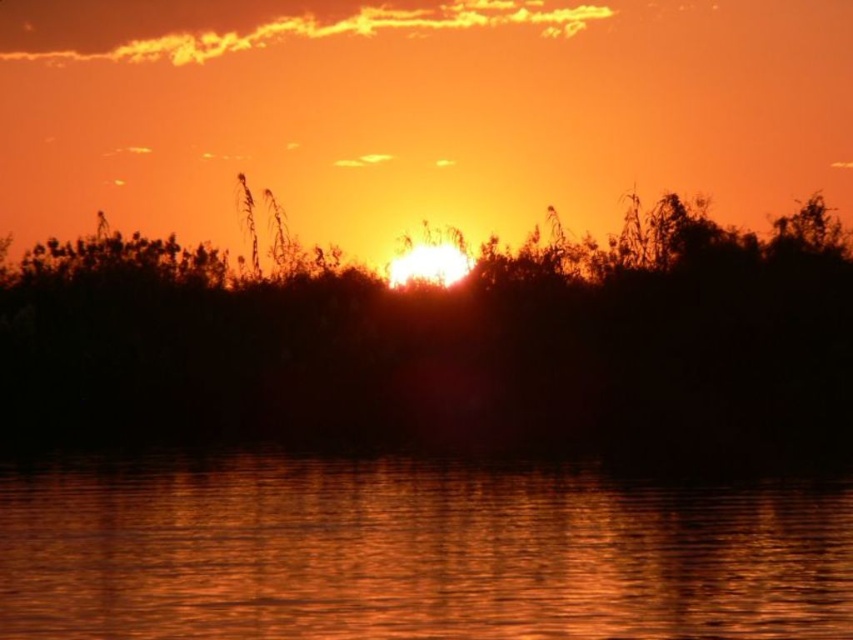
Question: Does silhouette leafy tree at center have a greater width compared to glistening water at center?

Choices:
 (A) yes
 (B) no

Answer: (A)

Question: Which point is farther to the camera?

Choices:
 (A) glistening water at center
 (B) silhouette leafy tree at center

Answer: (B)

Question: Which of the following is the farthest from the observer?

Choices:
 (A) silhouette leafy tree at center
 (B) glistening water at center

Answer: (A)

Question: Which of the following is the closest to the observer?

Choices:
 (A) silhouette leafy tree at center
 (B) glistening water at center

Answer: (B)

Question: Is silhouette leafy tree at center in front of glistening water at center?

Choices:
 (A) no
 (B) yes

Answer: (A)

Question: Is silhouette leafy tree at center bigger than glistening water at center?

Choices:
 (A) yes
 (B) no

Answer: (A)